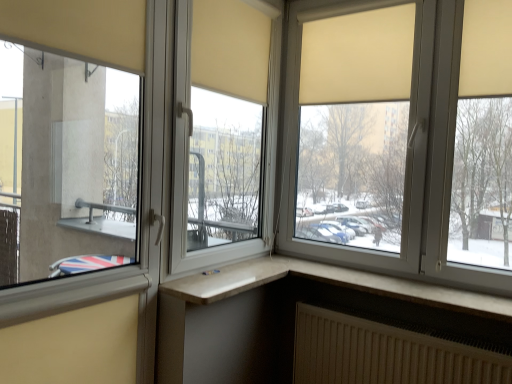
Question: Is matte glass window at left, the first window when ordered from left to right, located outside matte beige roller blind at upper right, which ranks as the 2th window in left-to-right order?

Choices:
 (A) yes
 (B) no

Answer: (A)

Question: Can you confirm if matte glass window at left, the first window when ordered from left to right, is positioned to the left of matte beige roller blind at upper right, which ranks as the 2th window in left-to-right order?

Choices:
 (A) yes
 (B) no

Answer: (A)

Question: From a real-world perspective, is matte glass window at left, the first window when ordered from left to right, located higher than matte beige roller blind at upper right, which ranks as the 2th window in left-to-right order?

Choices:
 (A) yes
 (B) no

Answer: (B)

Question: Is matte glass window at left, the first window when ordered from left to right, bigger than matte beige roller blind at upper right, placed as the 2th window when sorted from right to left?

Choices:
 (A) yes
 (B) no

Answer: (B)

Question: Does matte glass window at left, arranged as the third window when viewed from the right, have a greater width compared to matte beige roller blind at upper right, placed as the 2th window when sorted from right to left?

Choices:
 (A) yes
 (B) no

Answer: (A)

Question: From the image's perspective, relative to matte glass window at left, the first window when ordered from left to right, is white textured radiator at lower right above or below?

Choices:
 (A) above
 (B) below

Answer: (B)

Question: Considering the positions of white textured radiator at lower right and matte glass window at left, arranged as the third window when viewed from the right, in the image, is white textured radiator at lower right taller or shorter than matte glass window at left, arranged as the third window when viewed from the right,?

Choices:
 (A) short
 (B) tall

Answer: (A)

Question: In the image, is white textured radiator at lower right positioned in front of or behind matte glass window at left, arranged as the third window when viewed from the right?

Choices:
 (A) front
 (B) behind

Answer: (B)

Question: Considering the positions of white textured radiator at lower right and matte glass window at left, the first window when ordered from left to right, in the image, is white textured radiator at lower right wider or thinner than matte glass window at left, the first window when ordered from left to right,?

Choices:
 (A) thin
 (B) wide

Answer: (A)

Question: Is point (221, 294) positioned closer to the camera than point (436, 210)?

Choices:
 (A) closer
 (B) farther

Answer: (A)

Question: From the image's perspective, relative to matte beige roller blind at upper right, which ranks as the 2th window in left-to-right order, is white plastic window at lower right, marked as the third window in a left-to-right arrangement, above or below?

Choices:
 (A) above
 (B) below

Answer: (B)

Question: Considering their positions, is white plastic window at lower right, the 1th window viewed from the right, located in front of or behind matte beige roller blind at upper right, which ranks as the 2th window in left-to-right order?

Choices:
 (A) front
 (B) behind

Answer: (A)

Question: Is white plastic window at lower right, the 1th window viewed from the right, situated inside matte beige roller blind at upper right, which ranks as the 2th window in left-to-right order, or outside?

Choices:
 (A) outside
 (B) inside

Answer: (A)

Question: Is white plastic window at lower right, marked as the third window in a left-to-right arrangement, inside the boundaries of matte glass window at left, the first window when ordered from left to right, or outside?

Choices:
 (A) inside
 (B) outside

Answer: (B)

Question: Looking at the image, does white plastic window at lower right, the 1th window viewed from the right, seem bigger or smaller compared to matte glass window at left, the first window when ordered from left to right?

Choices:
 (A) small
 (B) big

Answer: (A)